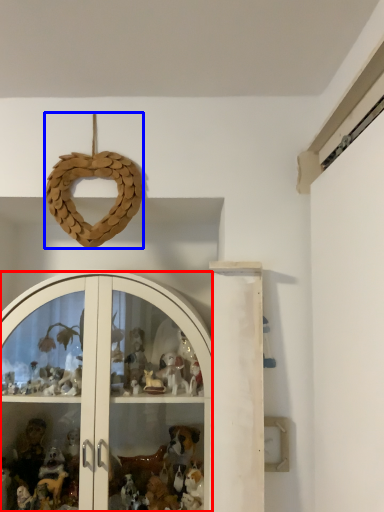
Question: Which of the following is the closest to the observer, glass door (highlighted by a red box) or toy (highlighted by a blue box)?

Choices:
 (A) glass door
 (B) toy

Answer: (A)